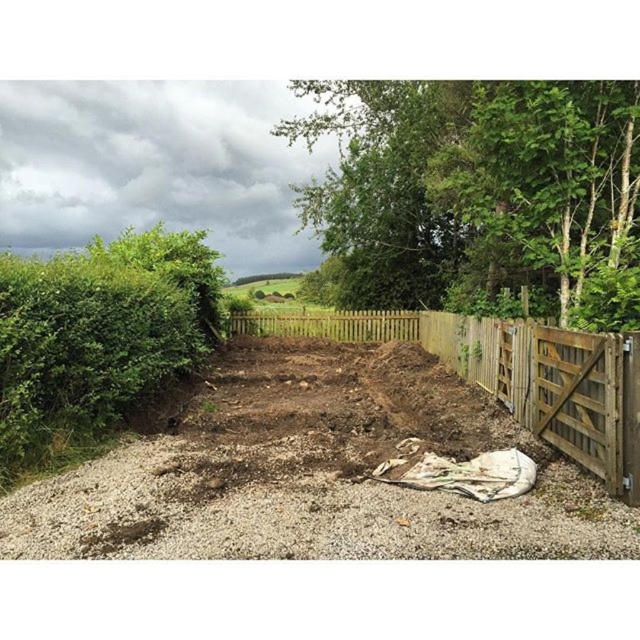
You are standing at the point marked at [243,406] and want to walk to the gate. The gravel path is 8 meters wide. Can you walk directly to the gate without stepping off the path?

The distance between you and the gate is 8.24 meters, which is slightly longer than the gravel path width of 8 meters. Therefore, you cannot walk directly to the gate without stepping off the path.

You are planning to plant a new flower bed in the garden. You need to decide between placing it near the green leafy tree at upper right or the green leafy hedge at left. Based on their positions, which one is closer to the front of the garden where the gravel path starts?

The green leafy tree at upper right is closer to the front of the garden where the gravel path starts because the green leafy hedge at left is positioned behind it.